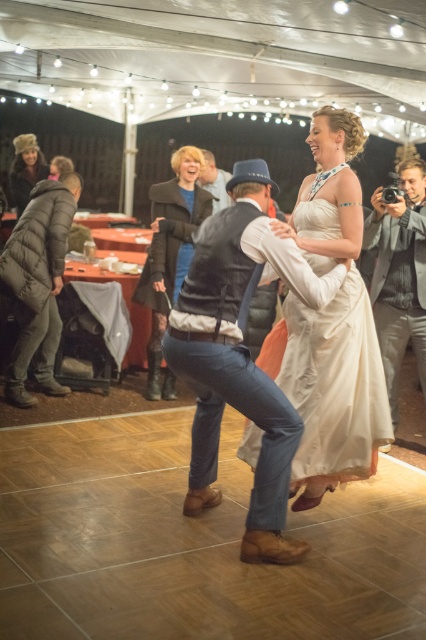
Who is positioned more to the right, dark brown leather jacket at upper center or leather jacket at center?

leather jacket at center

In the scene shown: Who is more forward, (169, 218) or (221, 188)?

Point (169, 218) is in front.

You are a GUI agent. You are given a task and a screenshot of the screen. Output one action in this format:
    pyautogui.click(x=<x>, y=<y>)
    Task: Click on the dark brown leather jacket at upper center
    The width and height of the screenshot is (426, 640).
    Given the screenshot: What is the action you would take?
    pyautogui.click(x=169, y=253)

In the scene shown: Does silky white gown at center have a larger size compared to leather jacket at center?

No.

Is silky white gown at center further to the viewer compared to leather jacket at center?

No.

Is point (316, 364) in front of point (221, 170)?

Yes.

This screenshot has height=640, width=426. In order to click on silky white gown at center in this screenshot , I will do [334, 385].

Locate an element on the screen. The height and width of the screenshot is (640, 426). dark gray puffer jacket at left is located at coordinates pyautogui.click(x=39, y=284).

Does dark gray puffer jacket at left have a larger size compared to fuzzy brown hat at upper left?

No.

Consider the image. Who is more forward, (34,268) or (39,147)?

Point (34,268) is in front.

Locate an element on the screen. The height and width of the screenshot is (640, 426). dark gray puffer jacket at left is located at coordinates click(x=39, y=284).